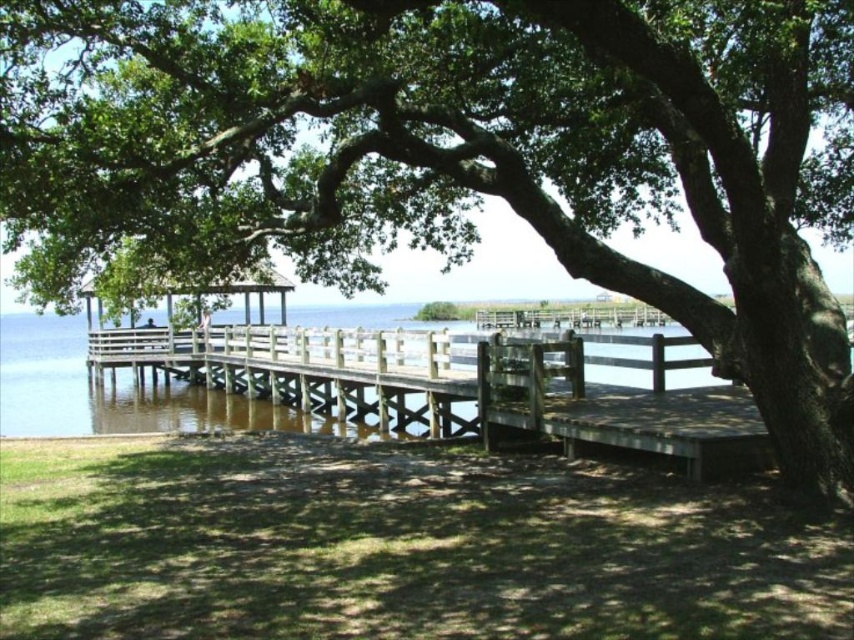
Question: Can you confirm if wooden water at center is positioned below white wooden gazebo at center?

Choices:
 (A) yes
 (B) no

Answer: (A)

Question: Which object is farther from the camera taking this photo?

Choices:
 (A) wooden water at center
 (B) white wooden gazebo at center

Answer: (A)

Question: Does wooden water at center come in front of white wooden gazebo at center?

Choices:
 (A) yes
 (B) no

Answer: (B)

Question: Where is wooden water at center located in relation to white wooden gazebo at center in the image?

Choices:
 (A) right
 (B) left

Answer: (A)